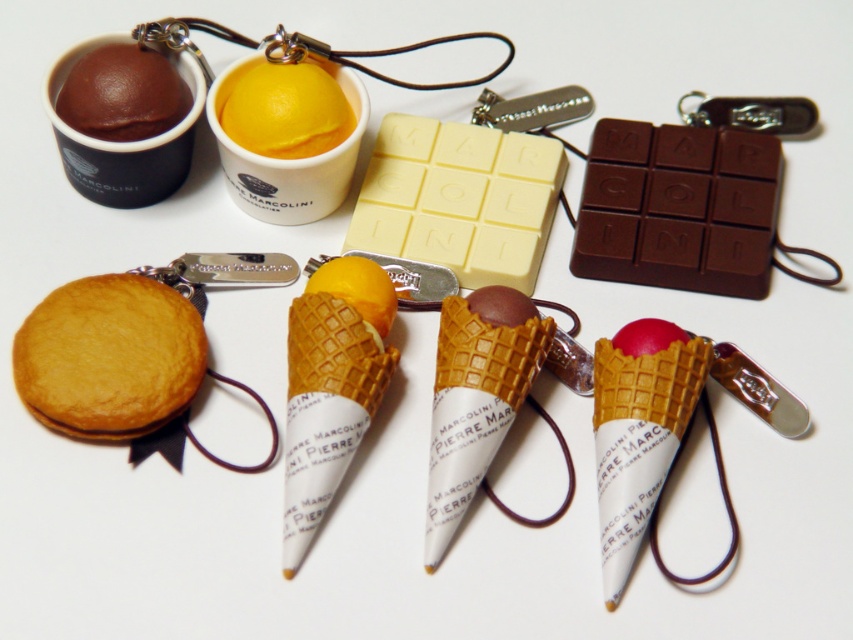
Looking at this image, you are a collector who wants to display the chocolate matte ice cream cone at center and the matte brown chocolate at upper left on a shelf. The shelf has a maximum length of 18 inches. Can both items fit side by side without overlapping?

The chocolate matte ice cream cone at center and the matte brown chocolate at upper left are 19.17 inches apart, which exceeds the shelf length of 18 inches. Therefore, they cannot fit side by side without overlapping.

You are organizing a display for a MARCOLINI promotional event. You have a dark chocolate bar at center right and a yellow matte ice cream cone at center. Which item should you place closer to the edge of the table to ensure it doesn

The yellow matte ice cream cone at center should be placed closer to the edge of the table because it is smaller than the dark chocolate bar at center right, which is larger and requires more space.

You are organizing a display of miniature food items on a shelf. You have the dark chocolate bar at center right and the chocolate matte ice cream cone at center. Based on their positions in the image, which item is placed higher on the shelf?

The dark chocolate bar at center right is placed higher on the shelf since it is positioned above the chocolate matte ice cream cone at center in the image.